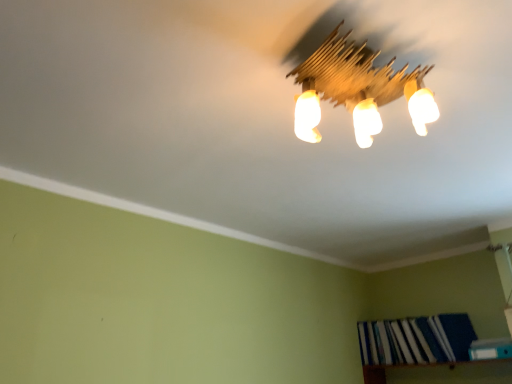
Question: Is wooden light fixture at upper center behind wooden bookshelf at lower right?

Choices:
 (A) yes
 (B) no

Answer: (B)

Question: Can you confirm if wooden light fixture at upper center is bigger than wooden bookshelf at lower right?

Choices:
 (A) yes
 (B) no

Answer: (B)

Question: From a real-world perspective, is wooden light fixture at upper center on wooden bookshelf at lower right?

Choices:
 (A) no
 (B) yes

Answer: (B)

Question: Is wooden light fixture at upper center at the left side of wooden bookshelf at lower right?

Choices:
 (A) no
 (B) yes

Answer: (B)

Question: Is wooden light fixture at upper center at the right side of wooden bookshelf at lower right?

Choices:
 (A) no
 (B) yes

Answer: (A)

Question: From the image's perspective, relative to blue hardcover book at lower right, acting as the 1th book starting from the back, is blue fabric book at lower right, arranged as the first book when viewed from the front, above or below?

Choices:
 (A) above
 (B) below

Answer: (A)

Question: Is blue fabric book at lower right, arranged as the 2th book when viewed from the back, inside or outside of blue hardcover book at lower right, which is counted as the 2th book, starting from the front?

Choices:
 (A) inside
 (B) outside

Answer: (B)

Question: Is blue fabric book at lower right, arranged as the 2th book when viewed from the back, wider or thinner than blue hardcover book at lower right, acting as the 1th book starting from the back?

Choices:
 (A) wide
 (B) thin

Answer: (B)

Question: In the image, is blue fabric book at lower right, arranged as the first book when viewed from the front, on the left side or the right side of blue hardcover book at lower right, acting as the 1th book starting from the back?

Choices:
 (A) right
 (B) left

Answer: (A)

Question: From the image's perspective, is wooden light fixture at upper center above or below wooden bookshelf at lower right?

Choices:
 (A) below
 (B) above

Answer: (B)

Question: Is wooden light fixture at upper center situated inside wooden bookshelf at lower right or outside?

Choices:
 (A) inside
 (B) outside

Answer: (B)

Question: From a real-world perspective, is wooden light fixture at upper center positioned above or below wooden bookshelf at lower right?

Choices:
 (A) above
 (B) below

Answer: (A)

Question: Based on their sizes in the image, would you say wooden light fixture at upper center is bigger or smaller than wooden bookshelf at lower right?

Choices:
 (A) small
 (B) big

Answer: (A)

Question: From a real-world perspective, relative to blue hardcover book at lower right, which is counted as the 2th book, starting from the front, is wooden light fixture at upper center vertically above or below?

Choices:
 (A) above
 (B) below

Answer: (A)

Question: Is wooden light fixture at upper center in front of or behind blue hardcover book at lower right, acting as the 1th book starting from the back, in the image?

Choices:
 (A) behind
 (B) front

Answer: (B)